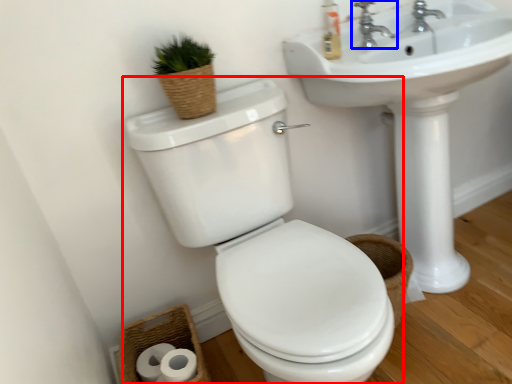
Question: Which object is further to the camera taking this photo, toilet (highlighted by a red box) or tap (highlighted by a blue box)?

Choices:
 (A) toilet
 (B) tap

Answer: (B)